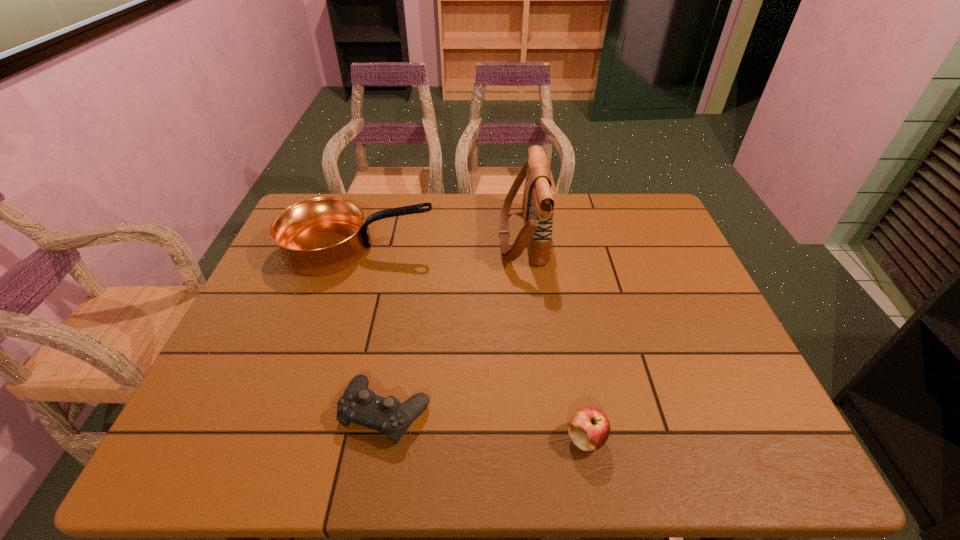
This screenshot has height=540, width=960. Find the location of `shoulder bag situated at the far edge`. shoulder bag situated at the far edge is located at coordinates (x=538, y=204).

Locate an element on the screen. The width and height of the screenshot is (960, 540). frying pan that is positioned at the far edge is located at coordinates (320, 236).

Where is `apple located at the near edge`? Image resolution: width=960 pixels, height=540 pixels. apple located at the near edge is located at coordinates (589, 428).

Find the location of a particular element. This screenshot has width=960, height=540. control situated at the near edge is located at coordinates (359, 405).

Locate an element on the screen. The width and height of the screenshot is (960, 540). object that is at the left edge is located at coordinates (320, 236).

You are a GUI agent. You are given a task and a screenshot of the screen. Output one action in this format:
    pyautogui.click(x=<x>, y=<y>)
    Task: Click on the object present at the far left corner
    Image resolution: width=960 pixels, height=540 pixels.
    Given the screenshot: What is the action you would take?
    coord(320,236)

Find the location of `vacant area at the far edge of the desktop`. vacant area at the far edge of the desktop is located at coordinates (404, 218).

At what (x,y) coordinates should I click in order to perform the action: click on vacant space at the left edge. Please return your answer as a coordinate pair (x, y). Image resolution: width=960 pixels, height=540 pixels. Looking at the image, I should click on (265, 383).

I want to click on free space at the right edge of the desktop, so click(x=672, y=316).

Locate an element on the screen. This screenshot has height=540, width=960. free space that is in between the control and the tallest object is located at coordinates (454, 324).